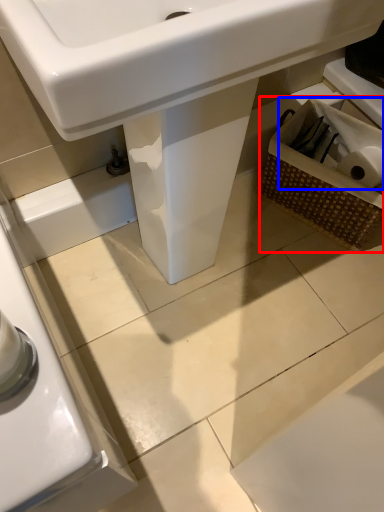
Question: Which object appears closest to the camera in this image, basket (highlighted by a red box) or toilet paper (highlighted by a blue box)?

Choices:
 (A) basket
 (B) toilet paper

Answer: (A)